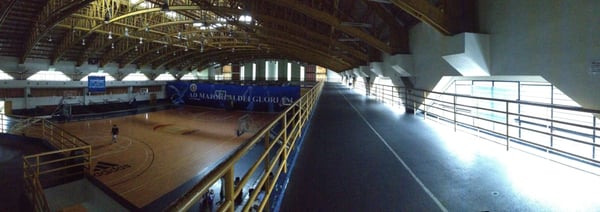
Locate an element on the screen. floor is located at coordinates 380,155, 8,155, 177,140.